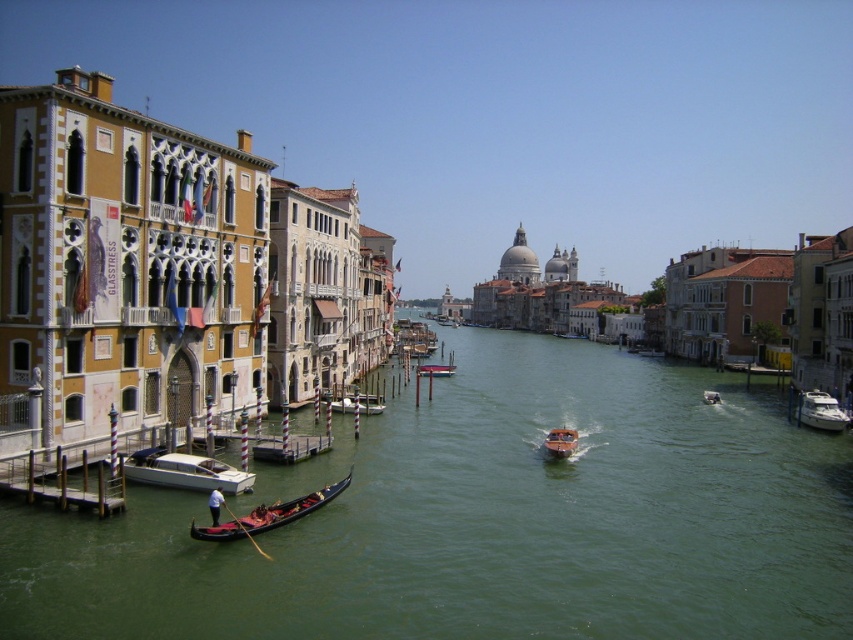
Question: Is white glossy motorboat at lower left positioned in front of metallic silver boat at center?

Choices:
 (A) no
 (B) yes

Answer: (B)

Question: Which point is closer to the camera?

Choices:
 (A) white glossy boat at center
 (B) green water at center
 (C) white glossy yacht at center-right

Answer: (B)

Question: Estimate the real-world distances between objects in this image. Which object is farther from the wooden gondola at center?

Choices:
 (A) metallic silver boat at center
 (B) red polished wood gondola at lower left
 (C) metallic orange boat at center
 (D) white glossy boat at center

Answer: (A)

Question: Is white glossy yacht at center-right wider than white glossy boat at center?

Choices:
 (A) no
 (B) yes

Answer: (B)

Question: Can you confirm if white glossy motorboat at lower left is wider than red polished wood gondola at lower left?

Choices:
 (A) yes
 (B) no

Answer: (B)

Question: Among these objects, which one is farthest from the camera?

Choices:
 (A) metallic silver boat at center
 (B) wooden gondola at center
 (C) white glossy motorboat at lower left

Answer: (A)